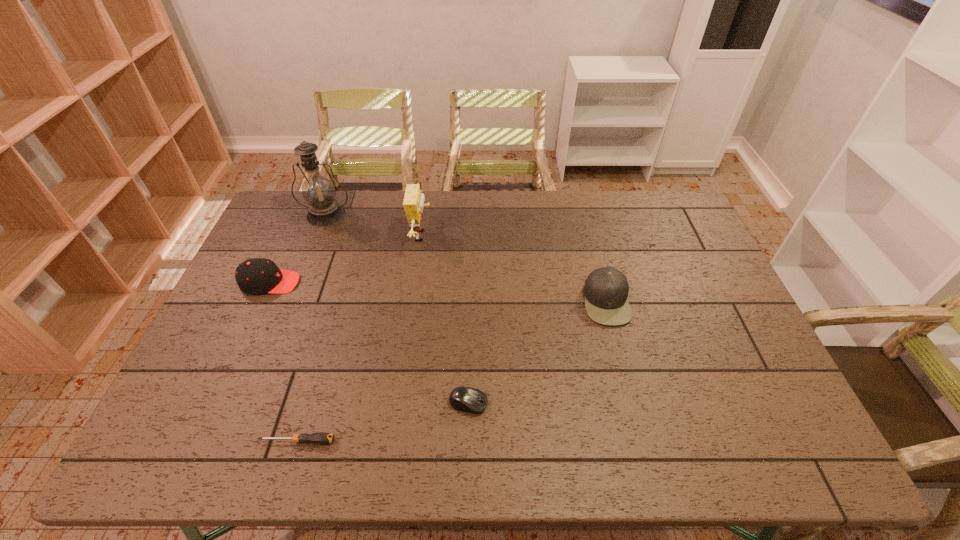
Where is `oil lamp that is at the left edge`? oil lamp that is at the left edge is located at coordinates (318, 191).

At what (x,y) coordinates should I click in order to perform the action: click on cap that is at the left edge. Please return your answer as a coordinate pair (x, y). Looking at the image, I should click on (254, 276).

You are a GUI agent. You are given a task and a screenshot of the screen. Output one action in this format:
    pyautogui.click(x=<x>, y=<y>)
    Task: Click on the object located at the far left corner
    The width and height of the screenshot is (960, 540).
    Given the screenshot: What is the action you would take?
    pyautogui.click(x=318, y=191)

At what (x,y) coordinates should I click in order to perform the action: click on vacant space at the far edge of the desktop. Please return your answer as a coordinate pair (x, y). Looking at the image, I should click on (342, 192).

Find the location of a particular element. This screenshot has height=540, width=960. free space at the near edge of the desktop is located at coordinates (570, 463).

Locate an element on the screen. free space at the right edge is located at coordinates (732, 382).

The image size is (960, 540). In order to click on vacant area between the fifth shortest object and the left cap in this screenshot , I will do `click(346, 259)`.

Find the location of `vacant point located between the left cap and the second object from right to left`. vacant point located between the left cap and the second object from right to left is located at coordinates (370, 343).

I want to click on free space between the sponge and the oil lamp, so point(373,225).

At what (x,y) coordinates should I click in order to perform the action: click on vacant area that lies between the fifth tallest object and the third object from right to left. Please return your answer as a coordinate pair (x, y). This screenshot has width=960, height=540. Looking at the image, I should click on (445, 320).